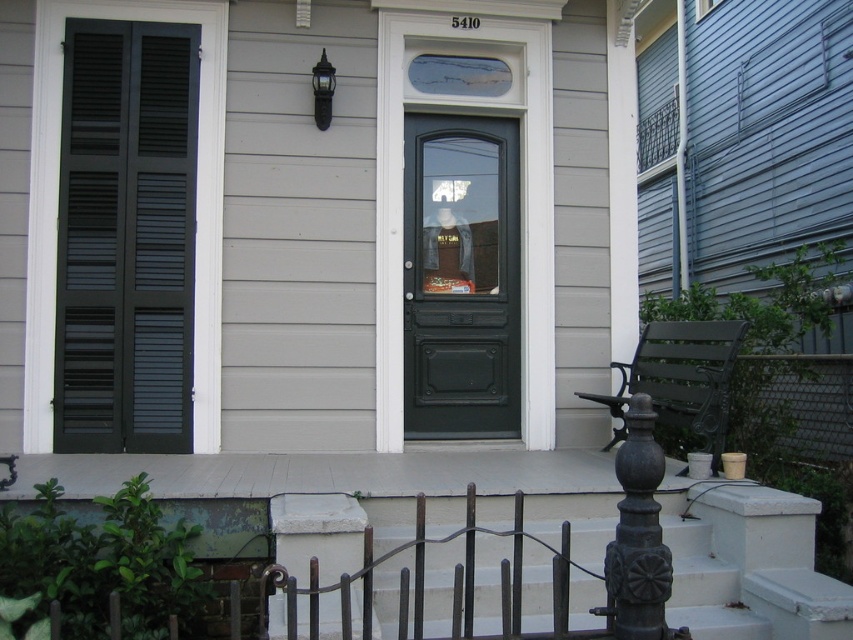
Is matte black door at center bigger than blue painted wood window at upper center?

Indeed, matte black door at center has a larger size compared to blue painted wood window at upper center.

Is matte black door at center positioned behind blue painted wood window at upper center?

No, matte black door at center is closer to the viewer.

Which is in front, point (448, 387) or point (704, 1)?

Positioned in front is point (448, 387).

The image size is (853, 640). Identify the location of matte black door at center. (461, 276).

Who is taller, dark gray louvered shutters at left or matte black door at center?

dark gray louvered shutters at left is taller.

Can you confirm if dark gray louvered shutters at left is thinner than matte black door at center?

No.

Image resolution: width=853 pixels, height=640 pixels. What do you see at coordinates (125, 237) in the screenshot? I see `dark gray louvered shutters at left` at bounding box center [125, 237].

I want to click on dark gray louvered shutters at left, so click(x=125, y=237).

Does dark gray louvered shutters at left have a smaller size compared to blue painted wood window at upper center?

Incorrect, dark gray louvered shutters at left is not smaller in size than blue painted wood window at upper center.

Which is below, dark gray louvered shutters at left or blue painted wood window at upper center?

dark gray louvered shutters at left is lower down.

Describe the element at coordinates (125, 237) in the screenshot. I see `dark gray louvered shutters at left` at that location.

The width and height of the screenshot is (853, 640). I want to click on dark gray louvered shutters at left, so click(x=125, y=237).